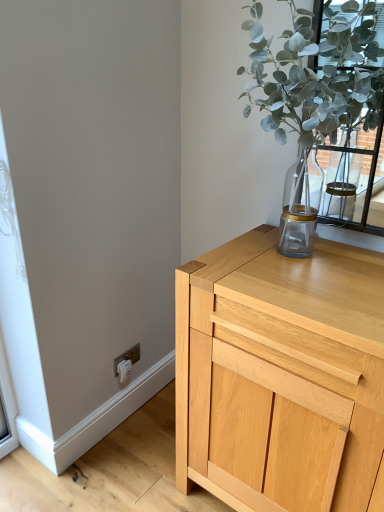
Locate an element on the screen. The height and width of the screenshot is (512, 384). free location above light wood cabinet at upper right (from a real-world perspective) is located at coordinates [309, 276].